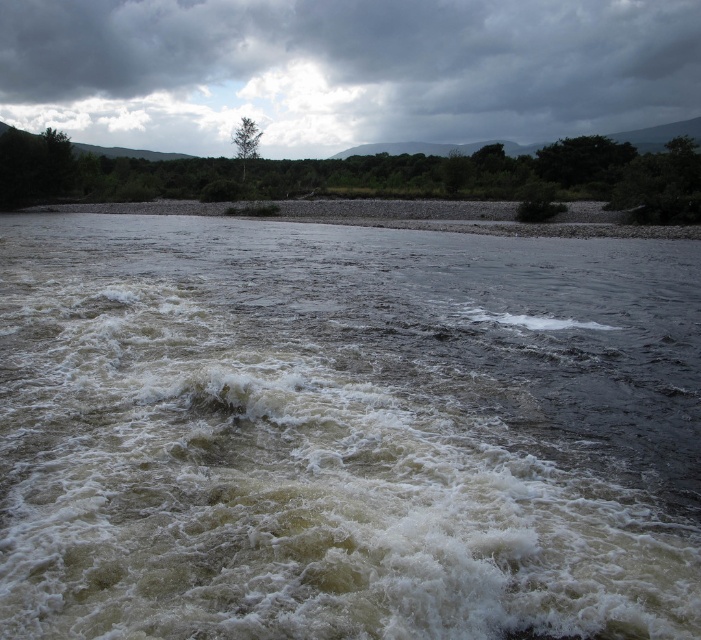
Can you confirm if cloudy sky at upper center is bigger than green matte tree at upper center?

Indeed, cloudy sky at upper center has a larger size compared to green matte tree at upper center.

Who is positioned more to the right, cloudy sky at upper center or green matte tree at upper center?

cloudy sky at upper center is more to the right.

Is point (348, 58) more distant than point (231, 138)?

No, it is in front of (231, 138).

Locate an element on the screen. This screenshot has height=640, width=701. cloudy sky at upper center is located at coordinates 343,70.

Can you confirm if white frothy water at center is positioned to the right of green leafy tree at upper center?

Yes, white frothy water at center is to the right of green leafy tree at upper center.

Is white frothy water at center thinner than green leafy tree at upper center?

Yes, white frothy water at center is thinner than green leafy tree at upper center.

Between point (240, 285) and point (440, 156), which one is positioned behind?

The point (440, 156) is more distant.

Where is `white frothy water at center`? This screenshot has height=640, width=701. white frothy water at center is located at coordinates (343, 432).

Locate an element on the screen. The height and width of the screenshot is (640, 701). cloudy sky at upper center is located at coordinates (343, 70).

Between point (524, 20) and point (605, 150), which one is positioned in front?

Point (605, 150) is in front.

What do you see at coordinates (343, 70) in the screenshot? Image resolution: width=701 pixels, height=640 pixels. I see `cloudy sky at upper center` at bounding box center [343, 70].

The width and height of the screenshot is (701, 640). Identify the location of cloudy sky at upper center. (343, 70).